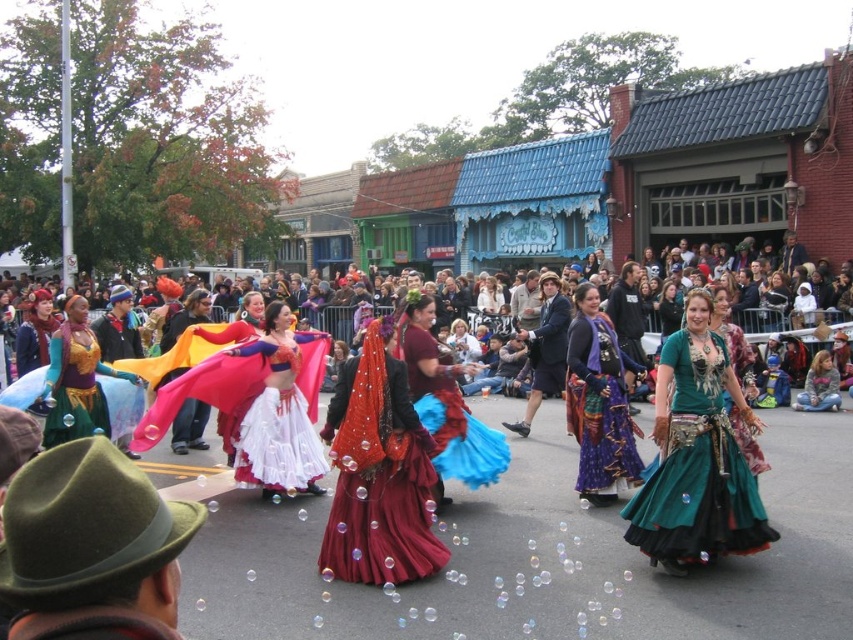
You are a photographer standing at the corner of the street. You want to capture a photo of the matte red dress at center. What are the coordinates where you should aim your camera?

The coordinates for the matte red dress at center are point [257,404].

You are a photographer standing at the starting point of the parade route. You want to take a closeup shot of the purple satin dress at center. Given that your camera has a maximum zoom range of 100 feet, will you be able to capture the dress without moving closer?

The purple satin dress at center is 79.56 feet away from the camera. Since the camera can zoom up to 100 feet, it is within the maximum range. Therefore, you can capture the dress without moving closer.

You are a photographer standing at the edge of the parade. You want to capture a photo of both the matte red dress at center and the maroon satin skirt at center in the same frame. Your camera has a maximum zoom range that can cover 5 meters. Can you fit both objects in the frame without moving closer?

The distance between the matte red dress at center and the maroon satin skirt at center is 6.03 meters, which exceeds the camera maximum zoom range of 5 meters. Therefore, you cannot capture both in the same frame without moving closer.